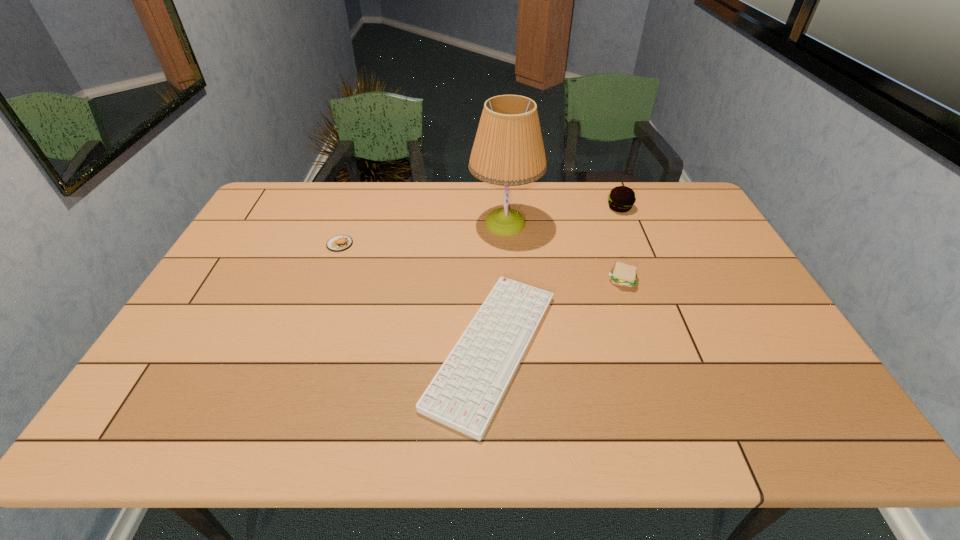
The width and height of the screenshot is (960, 540). I want to click on lamp, so click(x=508, y=150).

What are the coordinates of `the second tallest object` in the screenshot? It's located at (621, 198).

Image resolution: width=960 pixels, height=540 pixels. I want to click on the tallest patty, so click(621, 198).

You are a GUI agent. You are given a task and a screenshot of the screen. Output one action in this format:
    pyautogui.click(x=<x>, y=<y>)
    Task: Click on the nearest patty
    
    Given the screenshot: What is the action you would take?
    pyautogui.click(x=622, y=274)

The image size is (960, 540). In order to click on the second farthest patty in this screenshot , I will do `click(338, 243)`.

Where is `the leftmost patty`? the leftmost patty is located at coordinates (338, 243).

In order to click on the shortest object in this screenshot , I will do `click(465, 393)`.

Locate an element on the screen. This screenshot has width=960, height=540. free location located 0.110m on the side of the lamp near the pull switch is located at coordinates pos(437,223).

You are a GUI agent. You are given a task and a screenshot of the screen. Output one action in this format:
    pyautogui.click(x=<x>, y=<y>)
    Task: Click on the vacant space located 0.110m on the side of the lamp near the pull switch
    This screenshot has width=960, height=540.
    Given the screenshot: What is the action you would take?
    pyautogui.click(x=437, y=223)

Where is `blank space located on the side of the lamp near the pull switch`? blank space located on the side of the lamp near the pull switch is located at coordinates (372, 223).